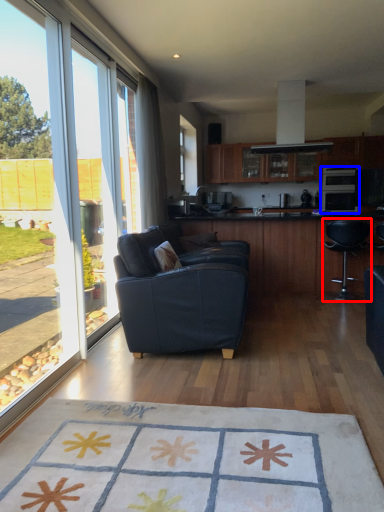
Question: Which object appears farthest to the camera in this image, chair (highlighted by a red box) or appliance (highlighted by a blue box)?

Choices:
 (A) chair
 (B) appliance

Answer: (B)